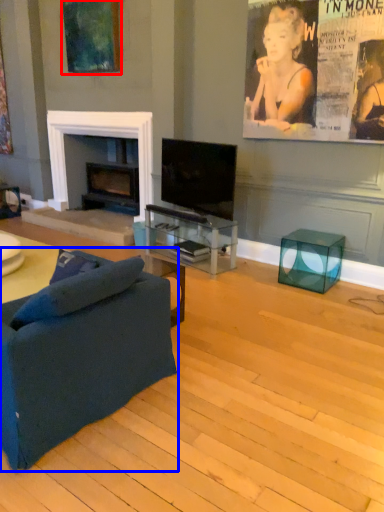
Question: Which object appears closest to the camera in this image, picture frame (highlighted by a red box) or studio couch (highlighted by a blue box)?

Choices:
 (A) picture frame
 (B) studio couch

Answer: (B)